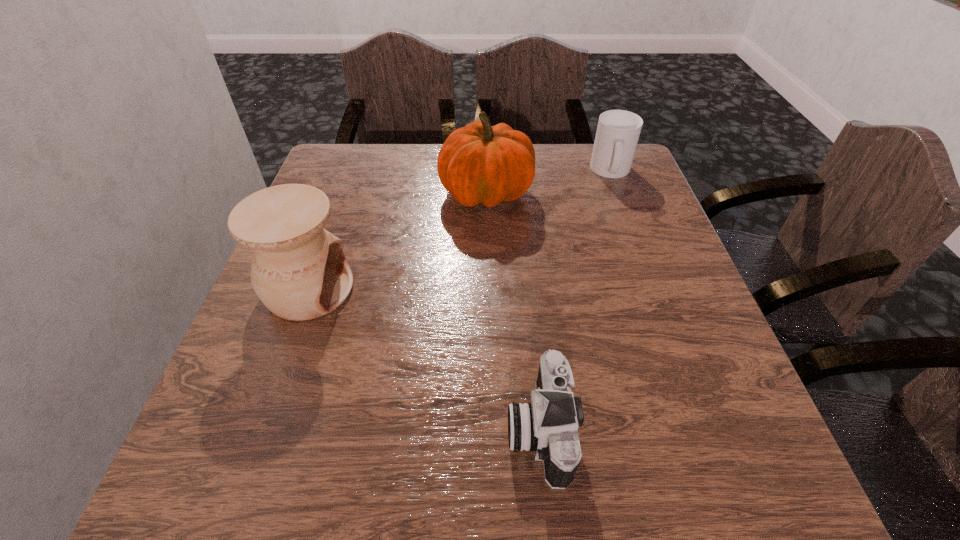
Where is `pumpkin`? Image resolution: width=960 pixels, height=540 pixels. pumpkin is located at coordinates (479, 163).

The width and height of the screenshot is (960, 540). What are the coordinates of `the second nearest object` in the screenshot? It's located at (299, 271).

This screenshot has height=540, width=960. What are the coordinates of `pottery` in the screenshot? It's located at (299, 271).

The height and width of the screenshot is (540, 960). Find the location of `mug`. mug is located at coordinates (618, 131).

The image size is (960, 540). I want to click on the second shortest object, so click(618, 131).

This screenshot has width=960, height=540. In order to click on the nearest object in this screenshot , I will do (548, 425).

Where is `the shortest object`? the shortest object is located at coordinates (548, 425).

You are a GUI agent. You are given a task and a screenshot of the screen. Output one action in this format:
    pyautogui.click(x=<x>, y=<y>)
    Task: Click on the vacant position located on the front of the pumpkin
    The height and width of the screenshot is (540, 960).
    Given the screenshot: What is the action you would take?
    pyautogui.click(x=489, y=352)

You are a GUI agent. You are given a task and a screenshot of the screen. Output one action in this format:
    pyautogui.click(x=<x>, y=<y>)
    Task: Click on the vacant space located 0.230m at the open side of the pottery
    
    Given the screenshot: What is the action you would take?
    pyautogui.click(x=468, y=289)

The image size is (960, 540). Identify the location of vacant area situated on the handle side of the rightmost object. (635, 232).